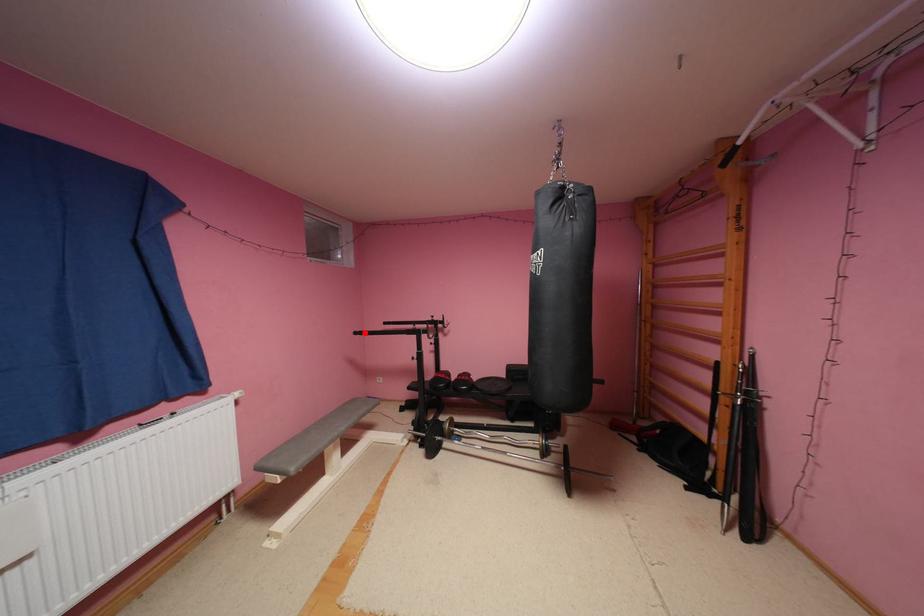
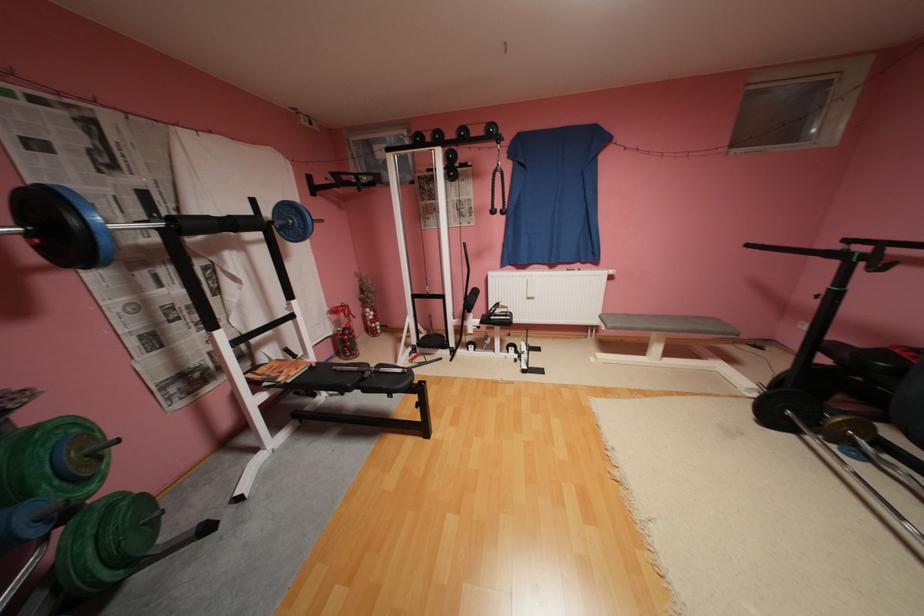
Locate, in the second image, the point that corresponds to the highlighted location in the first image.

(757, 246)